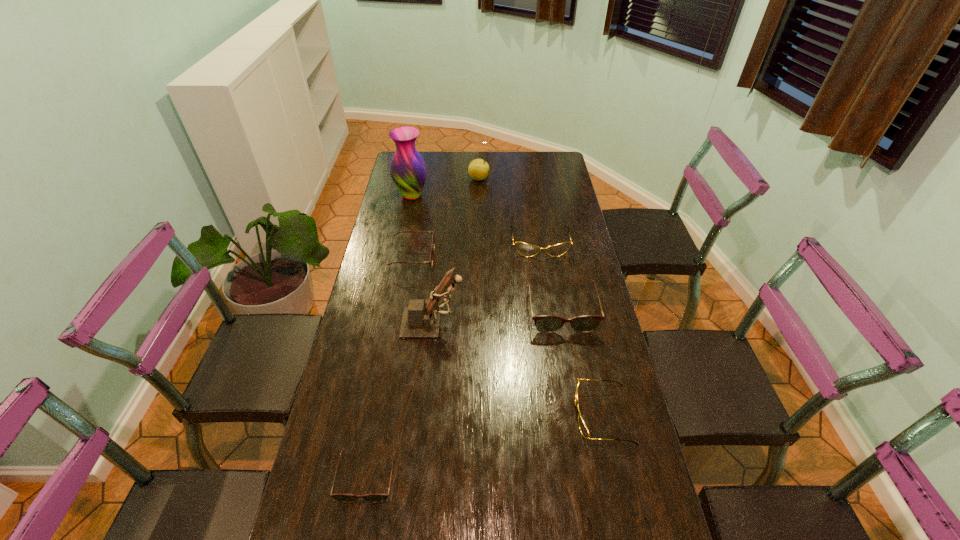
I want to click on the second farthest gold spectacles, so click(584, 430).

This screenshot has height=540, width=960. In order to click on the second smallest gold spectacles in this screenshot , I will do `click(584, 430)`.

In order to click on the smallest brown spectacles in this screenshot , I will do `click(346, 498)`.

At what (x,y) coordinates should I click in order to perform the action: click on the second nearest object. Please return your answer as a coordinate pair (x, y). The image size is (960, 540). Looking at the image, I should click on (346, 498).

This screenshot has width=960, height=540. In order to click on vacant region located on the right of the vase in this screenshot , I will do `click(441, 195)`.

At what (x,y) coordinates should I click in order to perform the action: click on free space located 0.280m on the front-facing side of the figurine. Please return your answer as a coordinate pair (x, y). This screenshot has width=960, height=540. Looking at the image, I should click on (549, 323).

Locate an element on the screen. This screenshot has width=960, height=540. vacant area located 0.100m on the logo side of the softball is located at coordinates (511, 179).

Locate an element on the screen. The image size is (960, 540). free space located at the front view of the biggest brown spectacles is located at coordinates (577, 400).

Identify the location of free space located on the front-facing side of the biggest gold spectacles. (546, 286).

You are a GUI agent. You are given a task and a screenshot of the screen. Output one action in this format:
    pyautogui.click(x=<x>, y=<y>)
    Task: Click on the free space located 0.170m at the front view of the second biggest brown spectacles
    The height and width of the screenshot is (540, 960).
    Given the screenshot: What is the action you would take?
    pyautogui.click(x=478, y=258)